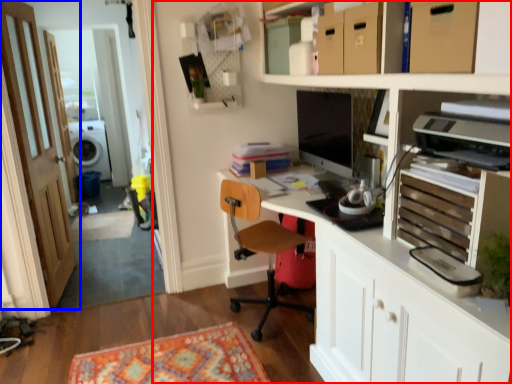
Question: Which object appears farthest to the camera in this image, entertainment center (highlighted by a red box) or door (highlighted by a blue box)?

Choices:
 (A) entertainment center
 (B) door

Answer: (B)